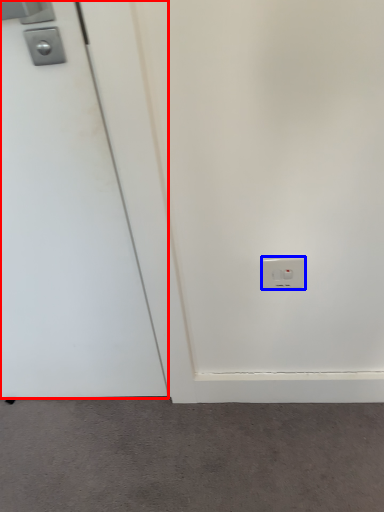
Question: Which point is further to the camera, door (highlighted by a red box) or power plugs and sockets (highlighted by a blue box)?

Choices:
 (A) door
 (B) power plugs and sockets

Answer: (B)